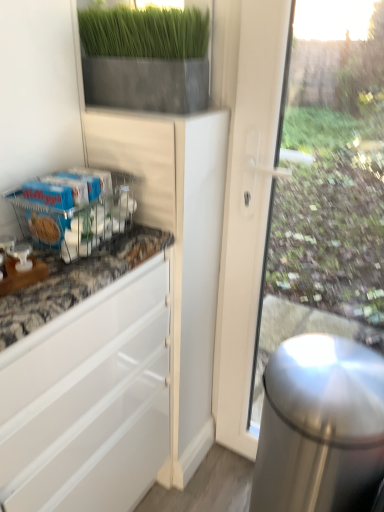
Question: Looking at the image, does polished stainless steel trash can at right seem bigger or smaller compared to metallic wire rack at lower left?

Choices:
 (A) big
 (B) small

Answer: (A)

Question: Choose the correct answer: Is polished stainless steel trash can at right inside metallic wire rack at lower left or outside it?

Choices:
 (A) outside
 (B) inside

Answer: (A)

Question: Which is nearer to the matte gray planter at upper center?

Choices:
 (A) polished stainless steel trash can at right
 (B) metallic wire rack at lower left

Answer: (B)

Question: Estimate the real-world distances between objects in this image. Which object is farther from the metallic wire rack at lower left?

Choices:
 (A) matte gray planter at upper center
 (B) polished stainless steel trash can at right

Answer: (B)